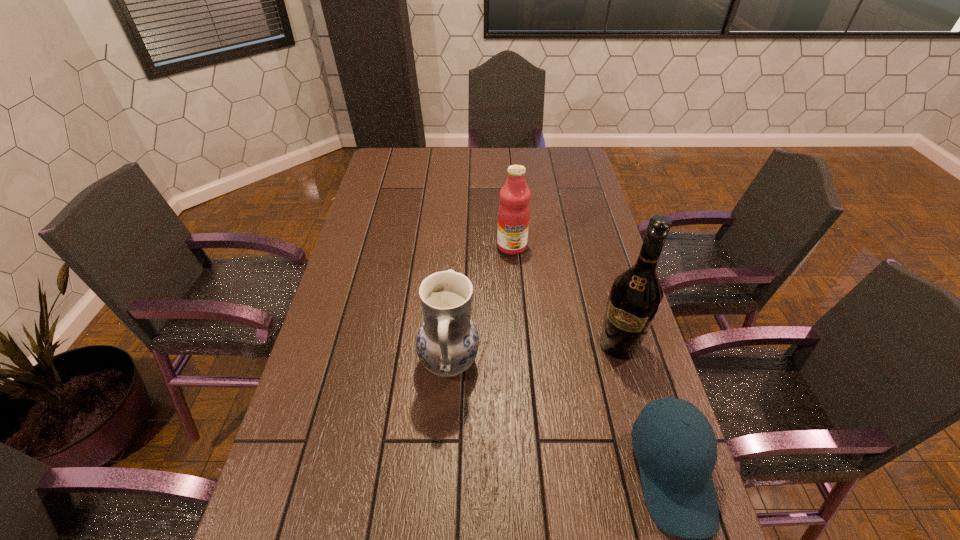
Locate an element on the screen. vacant space located on the label of the tallest object is located at coordinates (598, 386).

Find the location of a particular element. The height and width of the screenshot is (540, 960). object present at the right edge is located at coordinates (635, 297).

Locate an element on the screen. The image size is (960, 540). vacant point at the far edge is located at coordinates (417, 156).

I want to click on free region at the near edge of the desktop, so click(x=588, y=512).

Identify the location of vacant space at the left edge. The image size is (960, 540). (376, 210).

You are a GUI agent. You are given a task and a screenshot of the screen. Output one action in this format:
    pyautogui.click(x=<x>, y=<y>)
    Task: Click on the free location at the far left corner of the desktop
    
    Given the screenshot: What is the action you would take?
    pyautogui.click(x=387, y=158)

Locate an element on the screen. vacant area at the near left corner of the desktop is located at coordinates (291, 530).

Locate an element on the screen. The image size is (960, 540). vacant space that's between the farthest object and the pottery is located at coordinates (480, 304).

Image resolution: width=960 pixels, height=540 pixels. Identify the location of free space between the tallest object and the pottery. (534, 354).

Find the location of a particular element. This screenshot has height=540, width=960. free spot between the pottery and the fruit juice is located at coordinates (480, 304).